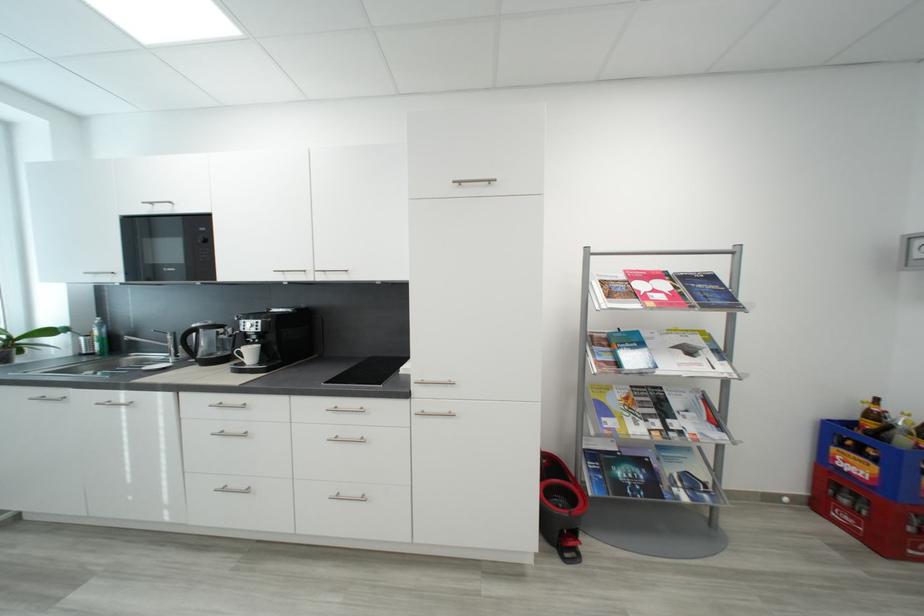
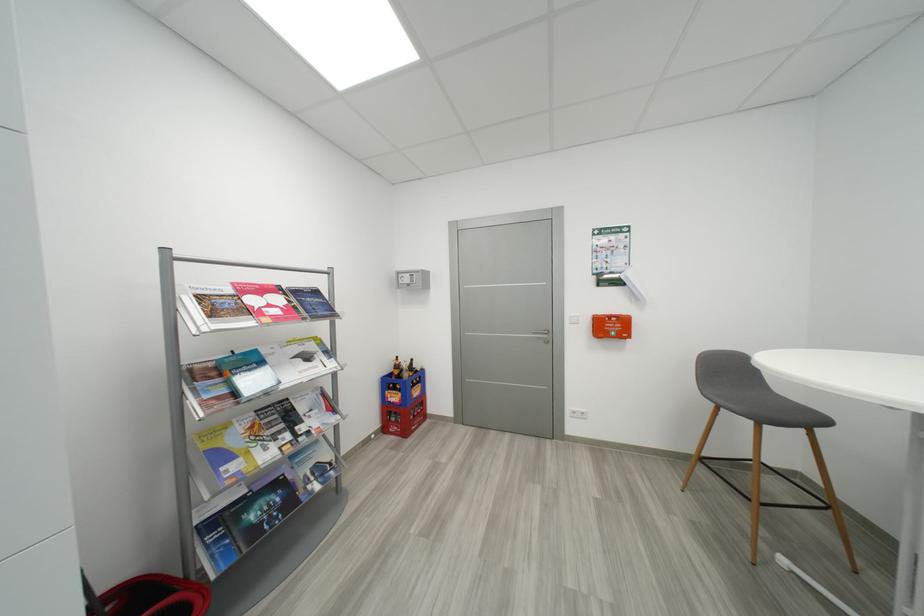
Find the pixel in the second image that matches the point at 664,424 in the first image.

(294, 438)